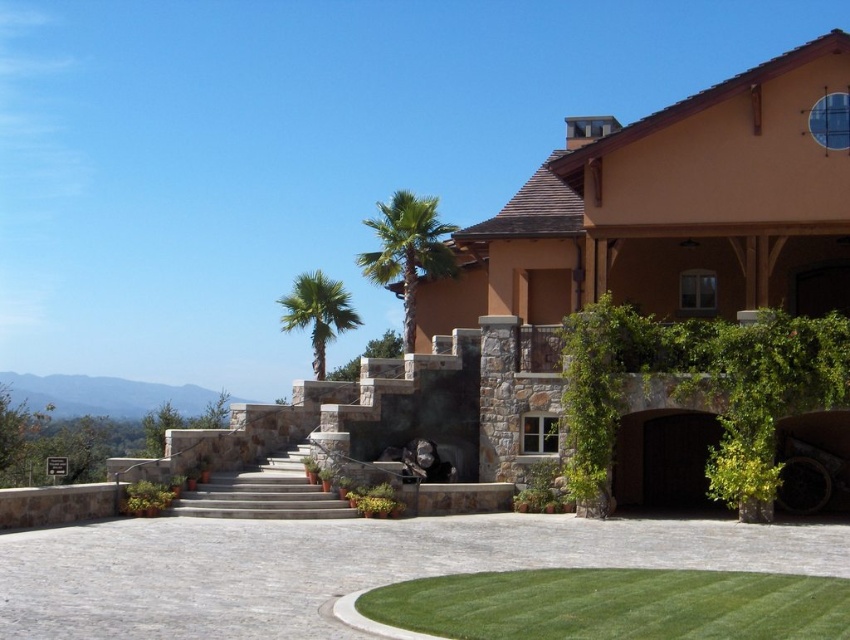
Question: Does gray cobblestone driveway at center have a smaller size compared to green leafy palm tree at center?

Choices:
 (A) no
 (B) yes

Answer: (B)

Question: Observing the image, what is the correct spatial positioning of green grass at lower center in reference to green leafy palm tree at center?

Choices:
 (A) left
 (B) right

Answer: (B)

Question: Which is farther from the green leafy palm at center?

Choices:
 (A) gray cobblestone driveway at center
 (B) green grass at lower center

Answer: (B)

Question: Which object is the closest to the green leafy palm tree at center?

Choices:
 (A) green grass at lower center
 (B) green leafy palm at center

Answer: (B)

Question: Can you confirm if green grass at lower center is positioned to the right of gray stone stairs at center?

Choices:
 (A) no
 (B) yes

Answer: (B)

Question: Among these points, which one is nearest to the camera?

Choices:
 (A) (395, 564)
 (B) (224, 484)
 (C) (293, 291)

Answer: (A)